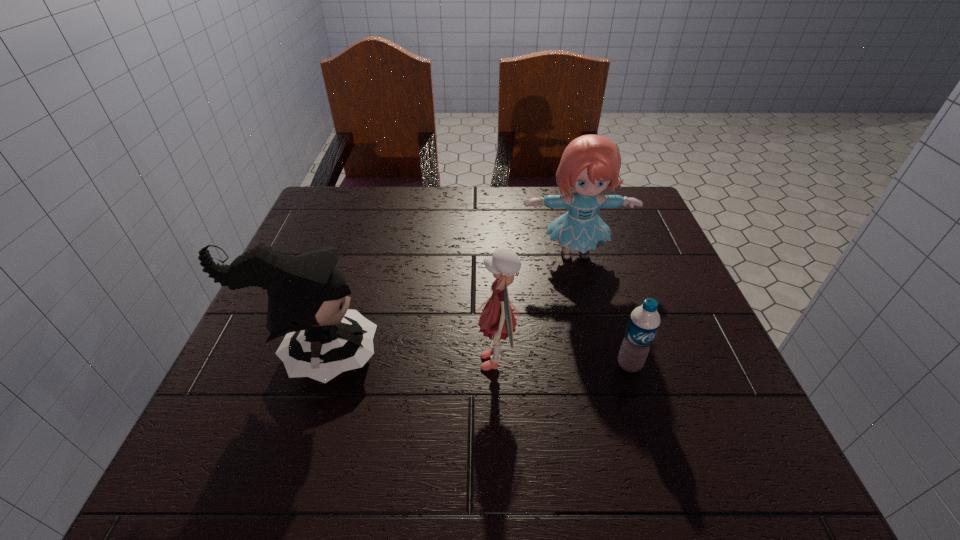
Locate which object ranks in proximity to the farthest doll. Please provide its 2D coordinates. Your answer should be formatted as a tuple, i.e. [(x, y)], where the tuple contains the x and y coordinates of a point satisfying the conditions above.

[(498, 320)]

Choose which doll is the second nearest neighbor to the second doll from left to right. Please provide its 2D coordinates. Your answer should be formatted as a tuple, i.e. [(x, y)], where the tuple contains the x and y coordinates of a point satisfying the conditions above.

[(307, 295)]

Identify the location of doll that is the second closest to the rightmost doll. This screenshot has height=540, width=960. (307, 295).

Where is `free location that satisfies the following two spatial constraints: 1. on the front-facing side of the farthest object; 2. on the front-facing side of the second object from left to right`? Image resolution: width=960 pixels, height=540 pixels. free location that satisfies the following two spatial constraints: 1. on the front-facing side of the farthest object; 2. on the front-facing side of the second object from left to right is located at coordinates (601, 362).

Where is `free spot that satisfies the following two spatial constraints: 1. on the front-facing side of the rightmost doll; 2. on the front-facing side of the second doll from right to left`? free spot that satisfies the following two spatial constraints: 1. on the front-facing side of the rightmost doll; 2. on the front-facing side of the second doll from right to left is located at coordinates (601, 362).

The height and width of the screenshot is (540, 960). What are the coordinates of `free location that satisfies the following two spatial constraints: 1. on the front-facing side of the farthest object; 2. on the front-facing side of the second object from left to right` in the screenshot? It's located at (601, 362).